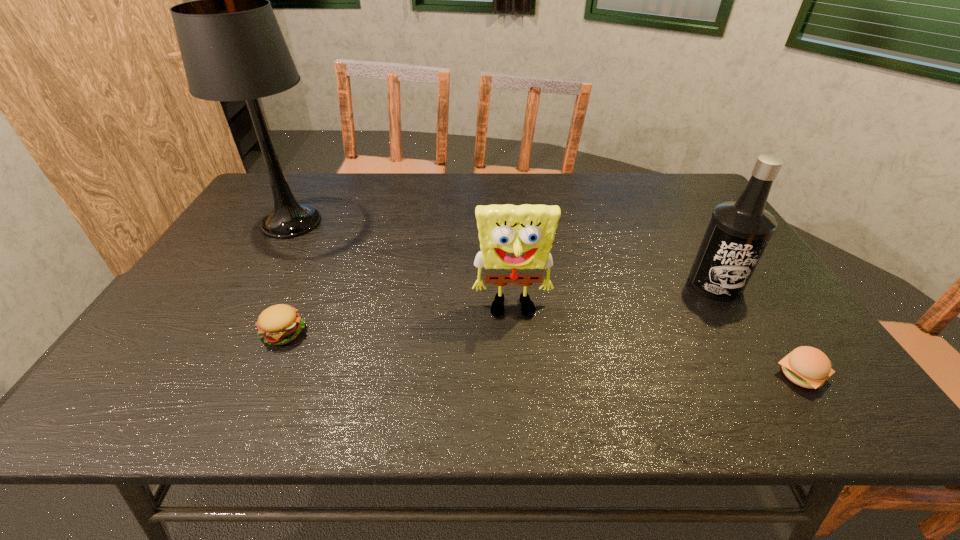
At what (x,y) coordinates should I click in order to perform the action: click on vacant space located 0.050m on the face of the third shortest object. Please return your answer as a coordinate pair (x, y). Image resolution: width=960 pixels, height=540 pixels. Looking at the image, I should click on (516, 341).

This screenshot has height=540, width=960. Find the location of `free location located 0.130m on the front of the farther hamburger`. free location located 0.130m on the front of the farther hamburger is located at coordinates (253, 399).

This screenshot has width=960, height=540. I want to click on blank space located 0.110m on the back of the right hamburger, so click(764, 319).

Find the location of a particular element. object present at the far edge is located at coordinates (232, 48).

The image size is (960, 540). I want to click on object at the near edge, so click(x=808, y=367).

Locate an element on the screen. object located at the left edge is located at coordinates (232, 48).

This screenshot has height=540, width=960. Find the location of `liquor that is at the right edge`. liquor that is at the right edge is located at coordinates (739, 231).

Locate an element on the screen. This screenshot has height=540, width=960. hamburger at the right edge is located at coordinates (808, 367).

At what (x,y) coordinates should I click in order to perform the action: click on object that is at the far left corner. Please return your answer as a coordinate pair (x, y). Looking at the image, I should click on (232, 48).

Locate an element on the screen. Image resolution: width=960 pixels, height=540 pixels. object that is at the near right corner is located at coordinates (808, 367).